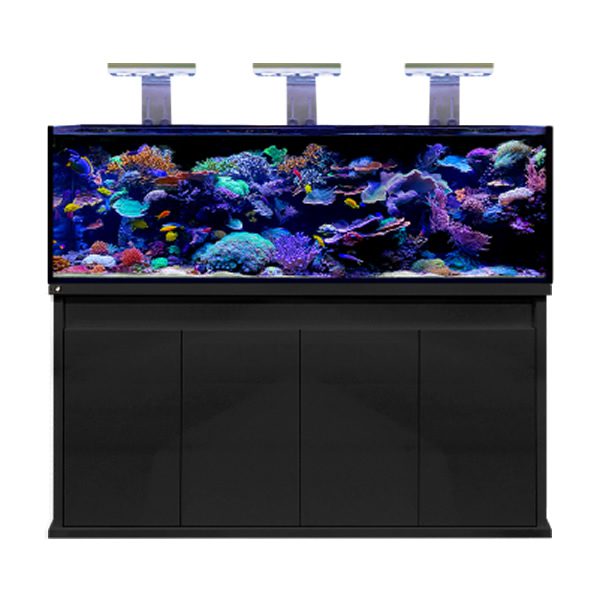
At what (x,y) coordinates should I click in order to perform the action: click on fish tank. Please return your answer as a coordinate pair (x, y). This screenshot has height=600, width=600. Looking at the image, I should click on (377, 150).